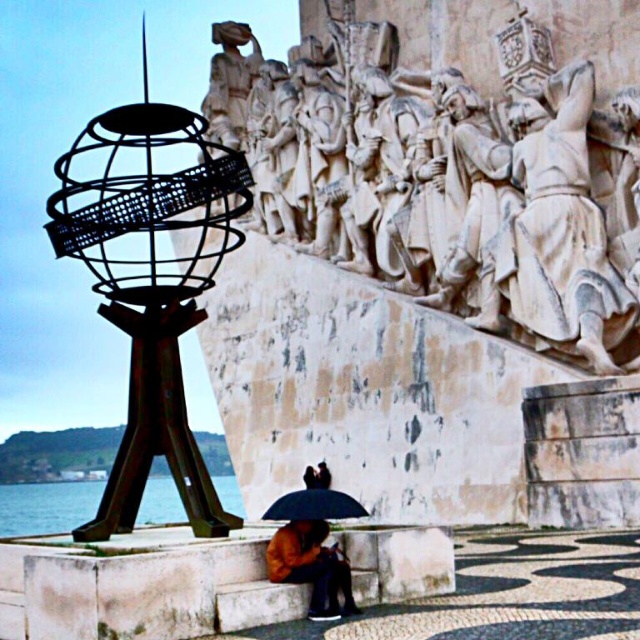
From the picture: You are a tourist holding a camera and want to take a photo of both the rustic metal globe at left and the black matte umbrella at lower center. Since you want both objects to appear equally large in the photo, which object should you move closer to, and which should you move farther away?

Since the rustic metal globe at left is wider than the black matte umbrella at lower center, you should move the black matte umbrella at lower center closer to the camera and move the rustic metal globe at left farther away to make them appear the same size in the photo.